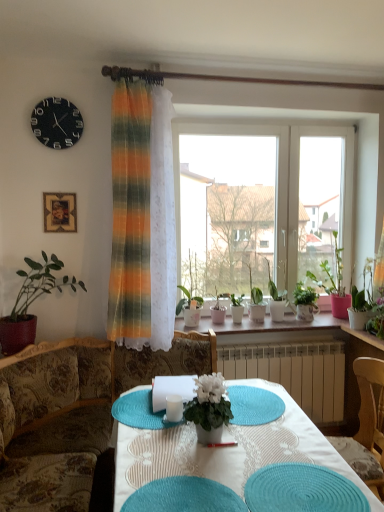
Identify the location of vacant space to the right of teal woven placemat at center. (287, 484).